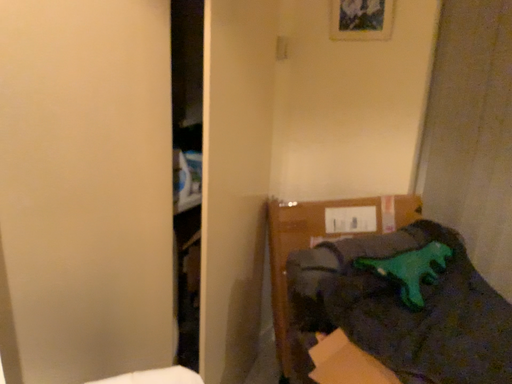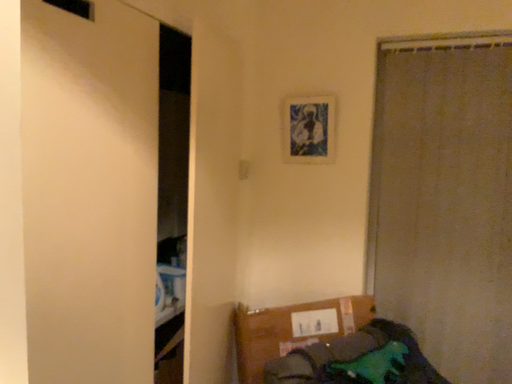
Question: How did the camera likely rotate when shooting the video?

Choices:
 (A) rotated downward
 (B) rotated upward

Answer: (B)